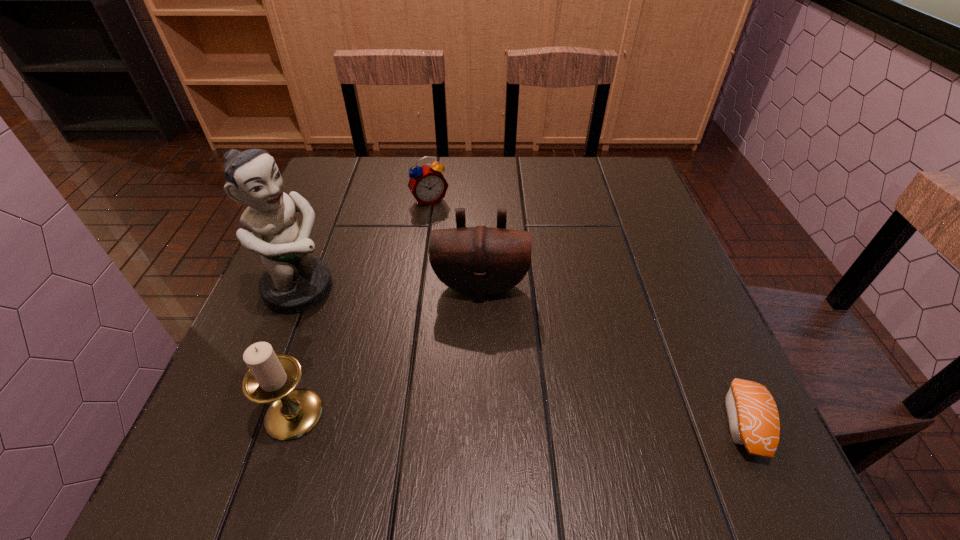
In the image, there is a desktop. At what (x,y) coordinates should I click in order to perform the action: click on vacant space at the far left corner. Please return your answer as a coordinate pair (x, y). Looking at the image, I should click on (349, 167).

Where is `vacant area at the near left corner`? vacant area at the near left corner is located at coordinates (218, 415).

Where is `vacant area that lies between the farthest object and the sushi`? This screenshot has height=540, width=960. vacant area that lies between the farthest object and the sushi is located at coordinates (587, 312).

Find the location of `free point between the alarm clock and the figurine`. free point between the alarm clock and the figurine is located at coordinates (365, 245).

You are a GUI agent. You are given a task and a screenshot of the screen. Output one action in this format:
    pyautogui.click(x=<x>, y=<y>)
    Task: Click on the free space between the candle holder and the alarm clock
    This screenshot has width=960, height=540.
    Given the screenshot: What is the action you would take?
    pyautogui.click(x=362, y=307)

Locate an element on the screen. The image size is (960, 540). unoccupied position between the figurine and the rightmost object is located at coordinates (522, 356).

The height and width of the screenshot is (540, 960). I want to click on vacant area between the pouch and the shortest object, so click(x=612, y=355).

I want to click on free spot between the rightmost object and the farthest object, so (587, 312).

Find the location of `vacant space that's between the farthest object and the rightmost object`. vacant space that's between the farthest object and the rightmost object is located at coordinates (587, 312).

Identify the location of empty space between the tallest object and the rightmost object. (522, 356).